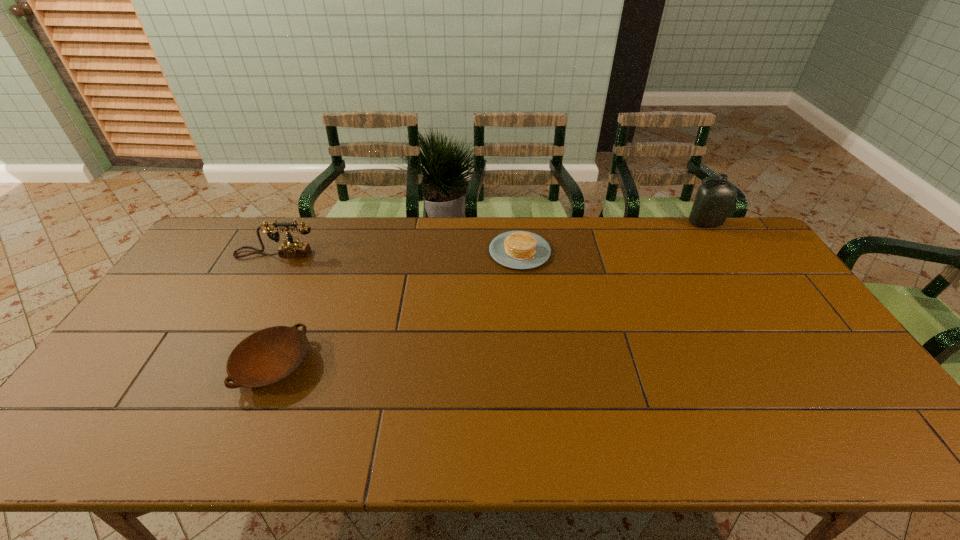
Find the location of a particular element. telephone positioned at the far edge is located at coordinates (292, 248).

Where is `pancake that is at the far edge`? Image resolution: width=960 pixels, height=540 pixels. pancake that is at the far edge is located at coordinates (515, 249).

Identify the location of object present at the left edge. The height and width of the screenshot is (540, 960). (292, 248).

The height and width of the screenshot is (540, 960). Identify the location of object situated at the right edge. (714, 200).

You are a GUI agent. You are given a task and a screenshot of the screen. Output one action in this format:
    pyautogui.click(x=<x>, y=<y>)
    Task: Click on the object present at the far left corner
    
    Given the screenshot: What is the action you would take?
    pyautogui.click(x=292, y=248)

Where is `object positioned at the far right corner`? Image resolution: width=960 pixels, height=540 pixels. object positioned at the far right corner is located at coordinates (714, 200).

The height and width of the screenshot is (540, 960). Find the location of `free space at the far edge of the desktop`. free space at the far edge of the desktop is located at coordinates (549, 229).

Identify the location of free space at the near edge of the desktop. (332, 428).

Find the location of `vacant point at the far left corner`. vacant point at the far left corner is located at coordinates (216, 257).

This screenshot has width=960, height=540. Find the location of `vacant region between the farthest object and the nearest object`. vacant region between the farthest object and the nearest object is located at coordinates (489, 294).